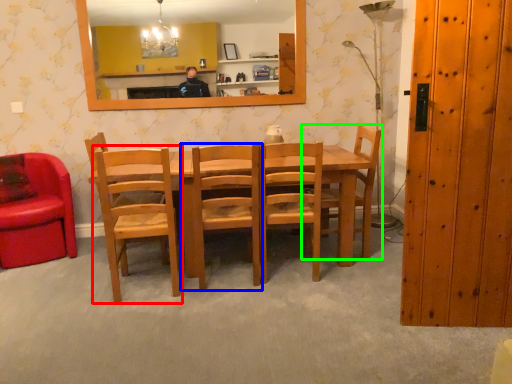
Question: Which is nearer to the chair (highlighted by a red box)? chair (highlighted by a blue box) or chair (highlighted by a green box).

Choices:
 (A) chair
 (B) chair

Answer: (A)